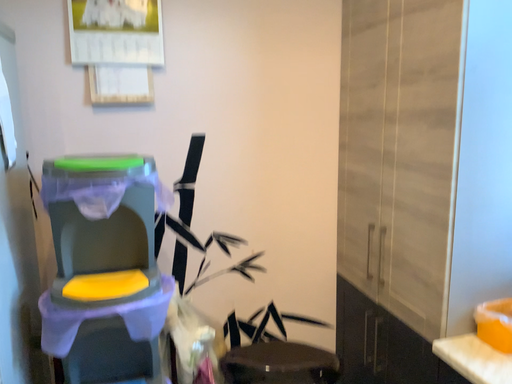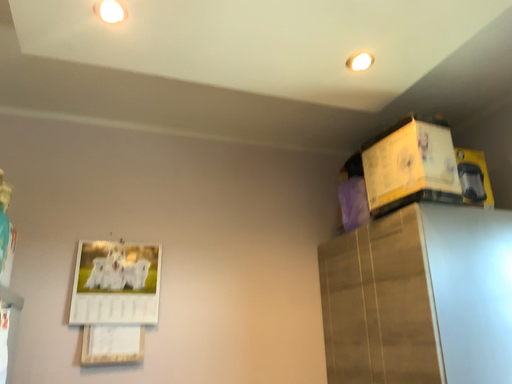
Question: Which way did the camera rotate in the video?

Choices:
 (A) rotated upward
 (B) rotated downward

Answer: (A)